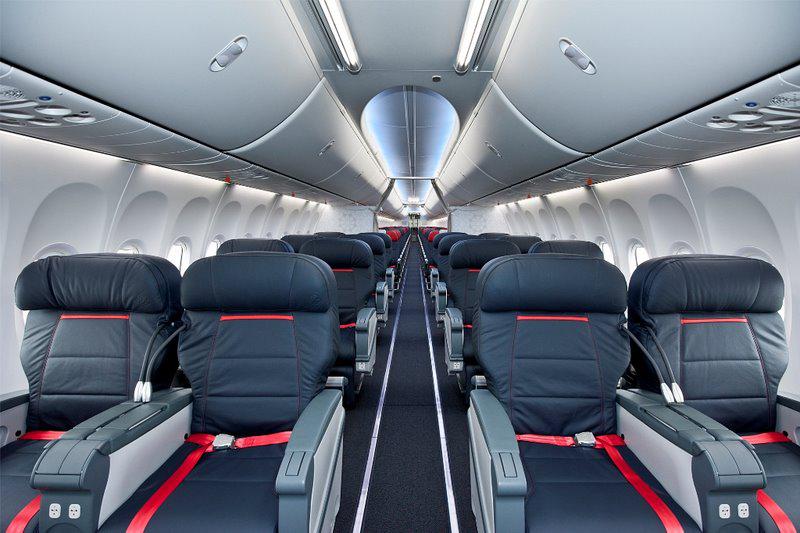
At what (x,y) coordinates should I click in order to perform the action: click on power outlets. Please return your answer as a coordinate pair (x, y). The height and width of the screenshot is (533, 800). Looking at the image, I should click on (53, 504), (70, 507), (724, 505), (750, 508).